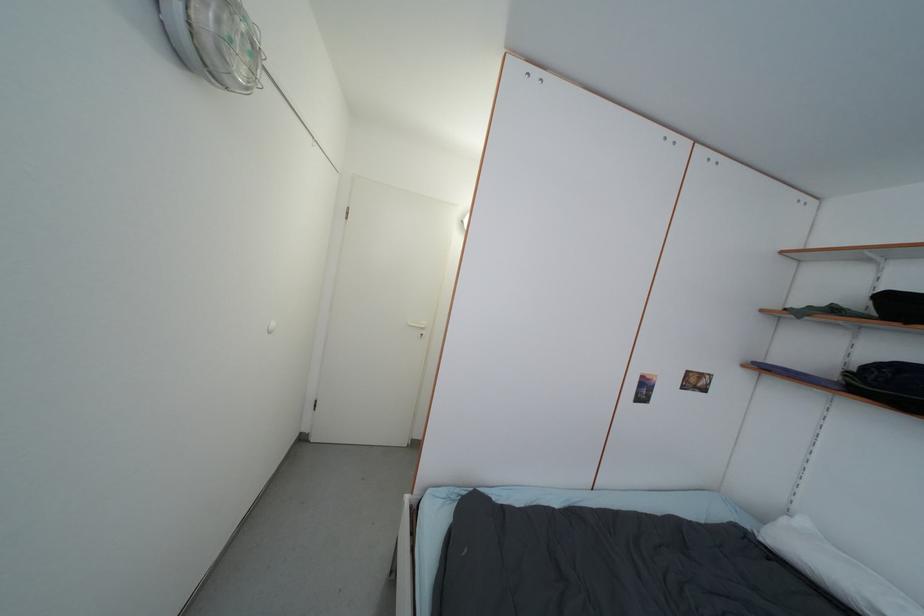
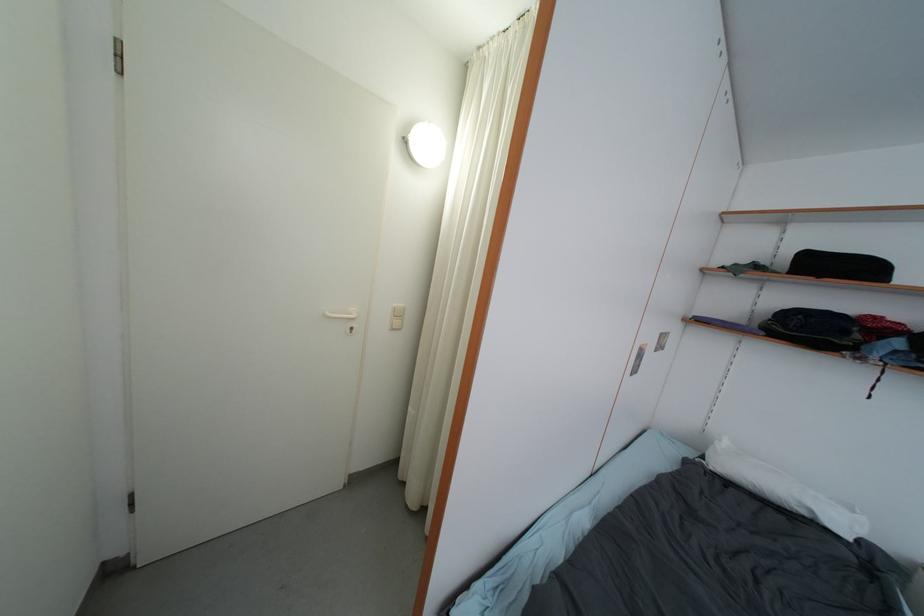
Looking at this image, in a continuous first-person perspective shot, in which direction is the camera moving?

The movement direction of the cameraman is left, forward.